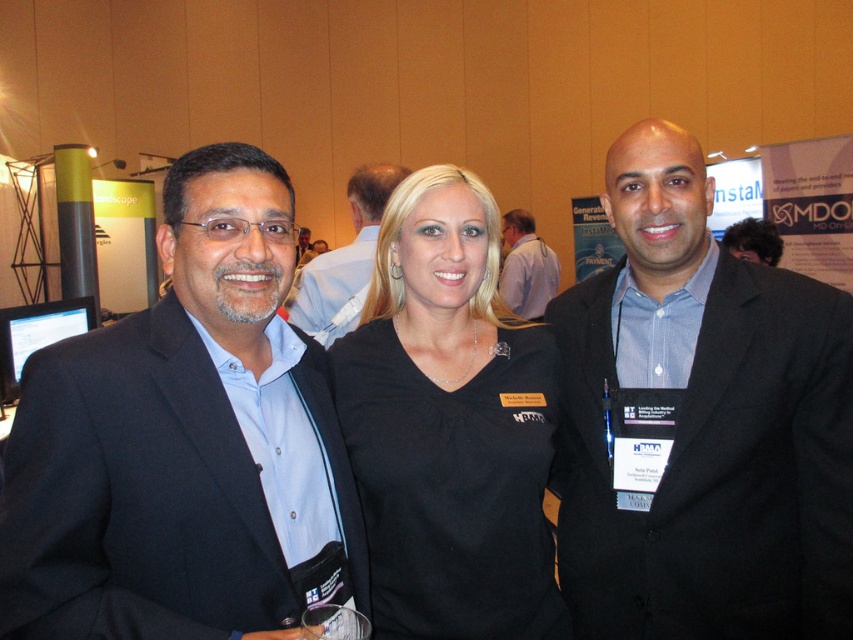
Does point (606, 465) lie in front of point (563, 632)?

No, (606, 465) is further to viewer.

Which is in front, point (665, 186) or point (403, 616)?

Point (403, 616)

This screenshot has width=853, height=640. I want to click on black suit at center, so (x=701, y=422).

In the scene shown: Does blue fabric suit at left have a greater height compared to matte black suit at center?

Yes.

Who is more distant from viewer, (x=146, y=554) or (x=300, y=285)?

The point (x=300, y=285) is more distant.

Identify the location of blue fabric suit at left. The height and width of the screenshot is (640, 853). pyautogui.click(x=184, y=442).

Which of these two, blue fabric suit at left or dark curly hair at center, stands taller?

Standing taller between the two is blue fabric suit at left.

Can you confirm if blue fabric suit at left is taller than dark curly hair at center?

Correct, blue fabric suit at left is much taller as dark curly hair at center.

The width and height of the screenshot is (853, 640). In order to click on blue fabric suit at left in this screenshot , I will do `click(184, 442)`.

The height and width of the screenshot is (640, 853). What are the coordinates of `blue fabric suit at left` in the screenshot? It's located at (184, 442).